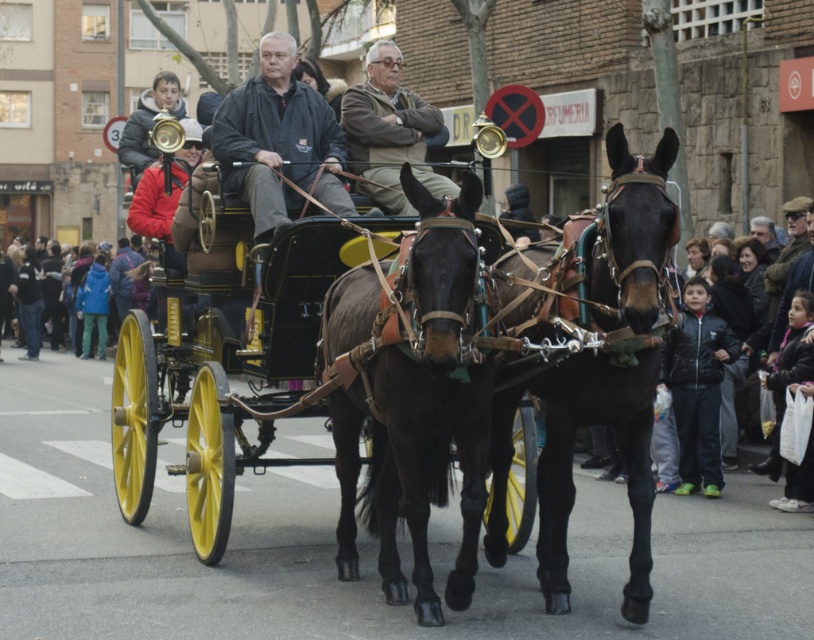
Question: Is shiny brass carriage at center bigger than black leather horse at center?

Choices:
 (A) no
 (B) yes

Answer: (B)

Question: From the image, what is the correct spatial relationship of shiny brass carriage at center in relation to dark gray jacket at center?

Choices:
 (A) below
 (B) above

Answer: (A)

Question: Which of these objects is positioned closest to the shiny brass carriage at center?

Choices:
 (A) black leather jacket at lower right
 (B) gray wool sweater at center

Answer: (B)

Question: Which object appears closest to the camera in this image?

Choices:
 (A) blue denim jacket at lower left
 (B) dark gray jacket at center
 (C) shiny brass carriage at center
 (D) shiny brown horse at center

Answer: (C)

Question: Which object is positioned closest to the dark gray jacket at center?

Choices:
 (A) shiny brown horse at center
 (B) black leather jacket at lower right

Answer: (A)

Question: Does black leather jacket at lower right lie behind blue denim jacket at lower left?

Choices:
 (A) no
 (B) yes

Answer: (A)